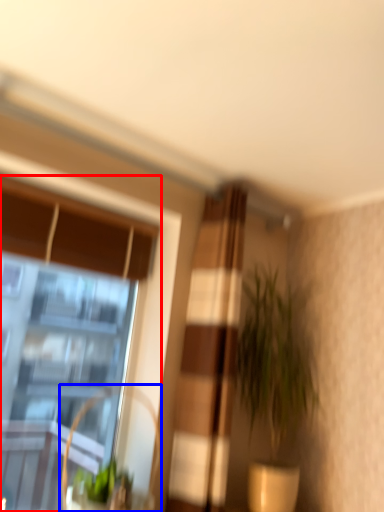
Question: Which of the following is the farthest to the observer, window (highlighted by a red box) or swivel chair (highlighted by a blue box)?

Choices:
 (A) window
 (B) swivel chair

Answer: (A)